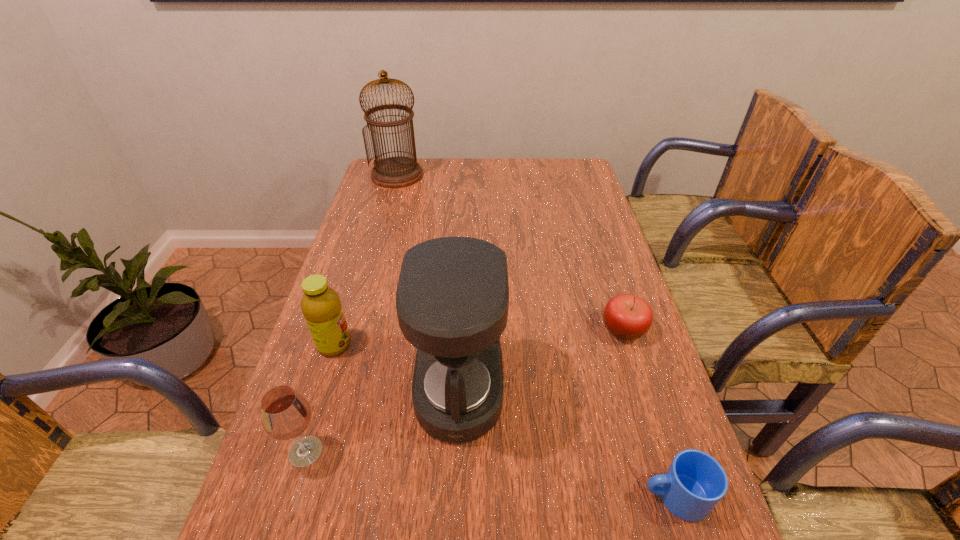
Where is `vacant space located on the back of the apple`? Image resolution: width=960 pixels, height=540 pixels. vacant space located on the back of the apple is located at coordinates (610, 287).

The height and width of the screenshot is (540, 960). Identify the location of vacant space located on the side of the mug with the handle. (545, 496).

Where is `free spot located 0.240m on the side of the mug with the handle`? The height and width of the screenshot is (540, 960). free spot located 0.240m on the side of the mug with the handle is located at coordinates (513, 496).

Locate an element on the screen. This screenshot has height=540, width=960. free region located 0.270m on the side of the mug with the handle is located at coordinates (496, 496).

Image resolution: width=960 pixels, height=540 pixels. I want to click on object that is at the far edge, so click(394, 172).

I want to click on birdcage at the left edge, so click(x=394, y=172).

The image size is (960, 540). In order to click on fruit juice at the left edge in this screenshot , I will do `click(321, 306)`.

Locate an element on the screen. wineglass present at the left edge is located at coordinates click(285, 414).

Find the location of a particular element. apple at the right edge is located at coordinates (626, 316).

You are a GUI agent. You are given a task and a screenshot of the screen. Output one action in this format:
    pyautogui.click(x=<x>, y=<y>)
    Task: Click on the mug located at the right edge
    
    Given the screenshot: What is the action you would take?
    pyautogui.click(x=695, y=482)